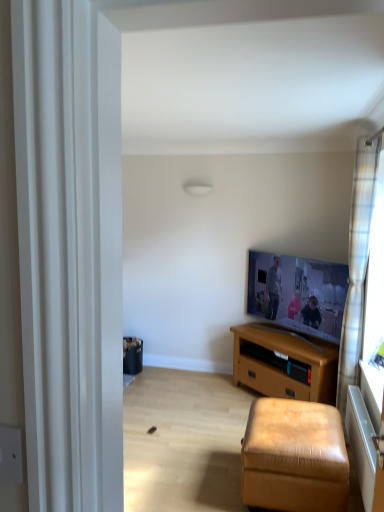
Describe the element at coordinates (284, 362) in the screenshot. The height and width of the screenshot is (512, 384). I see `brown wooden tv stand at center` at that location.

Measure the distance between brown wooden tv stand at center and camera.

They are 3.08 meters apart.

What are the coordinates of `plaid fabric curtain at right` in the screenshot? It's located at (357, 262).

The width and height of the screenshot is (384, 512). What are the coordinates of `leather-like stool at lower right` in the screenshot? It's located at (294, 457).

From a real-world perspective, who is located higher, brown wooden tv stand at center or plaid fabric curtain at right?

plaid fabric curtain at right, from a real-world perspective.

Is brown wooden tv stand at center shorter than plaid fabric curtain at right?

Indeed, brown wooden tv stand at center has a lesser height compared to plaid fabric curtain at right.

Between brown wooden tv stand at center and plaid fabric curtain at right, which one has smaller width?

plaid fabric curtain at right.

How many degrees apart are the facing directions of flat screen tv at upper right and brown wooden tv stand at center?

There is a 0.356-degree angle between the facing directions of flat screen tv at upper right and brown wooden tv stand at center.

Is flat screen tv at upper right bigger or smaller than brown wooden tv stand at center?

Clearly, flat screen tv at upper right is smaller in size than brown wooden tv stand at center.

From the image's perspective, does flat screen tv at upper right appear higher than brown wooden tv stand at center?

Indeed, from the image's perspective, flat screen tv at upper right is shown above brown wooden tv stand at center.

Is flat screen tv at upper right aimed at brown wooden tv stand at center?

No, flat screen tv at upper right is not facing towards brown wooden tv stand at center.

Which is behind, point (326, 414) or point (332, 265)?

The point (332, 265) is behind.

Is leather-like stool at lower right not near flat screen tv at upper right?

Yes, leather-like stool at lower right and flat screen tv at upper right are located far from each other.

From the image's perspective, is leather-like stool at lower right beneath flat screen tv at upper right?

Indeed, from the image's perspective, leather-like stool at lower right is shown beneath flat screen tv at upper right.

Which is more to the left, flat screen tv at upper right or leather-like stool at lower right?

leather-like stool at lower right.

From a real-world perspective, is flat screen tv at upper right above or below leather-like stool at lower right?

flat screen tv at upper right is above leather-like stool at lower right.

Would you say flat screen tv at upper right is a long distance from leather-like stool at lower right?

Yes, flat screen tv at upper right and leather-like stool at lower right are quite far apart.

From a real-world perspective, does plaid fabric curtain at right stand above brown wooden tv stand at center?

Correct, in the physical world, plaid fabric curtain at right is higher than brown wooden tv stand at center.

Between plaid fabric curtain at right and brown wooden tv stand at center, which one has smaller size?

plaid fabric curtain at right is smaller.

Identify the location of curtain above the brown wooden tv stand at center (from a real-world perspective). Image resolution: width=384 pixels, height=512 pixels. (357, 262).

Would you say plaid fabric curtain at right contains brown wooden tv stand at center?

No, brown wooden tv stand at center is located outside of plaid fabric curtain at right.

Who is shorter, brown wooden tv stand at center or leather-like stool at lower right?

With less height is leather-like stool at lower right.

Considering the positions of objects brown wooden tv stand at center and leather-like stool at lower right in the image provided, who is in front, brown wooden tv stand at center or leather-like stool at lower right?

leather-like stool at lower right is in front.

Is brown wooden tv stand at center facing towards leather-like stool at lower right?

Yes, brown wooden tv stand at center faces towards leather-like stool at lower right.

Does point (331, 345) appear closer or farther from the camera than point (320, 419)?

Clearly, point (331, 345) is more distant from the camera than point (320, 419).

Does plaid fabric curtain at right lie behind leather-like stool at lower right?

Yes, it is behind leather-like stool at lower right.

Can we say plaid fabric curtain at right lies outside leather-like stool at lower right?

Indeed, plaid fabric curtain at right is completely outside leather-like stool at lower right.

Looking at this image, from the image's perspective, between plaid fabric curtain at right and leather-like stool at lower right, which one is located above?

plaid fabric curtain at right, from the image's perspective.

Considering the relative sizes of plaid fabric curtain at right and leather-like stool at lower right in the image provided, is plaid fabric curtain at right wider than leather-like stool at lower right?

Incorrect, the width of plaid fabric curtain at right does not surpass that of leather-like stool at lower right.

I want to click on desk lying behind the plaid fabric curtain at right, so click(284, 362).

Where is `desk to the left of flat screen tv at upper right`? desk to the left of flat screen tv at upper right is located at coordinates (284, 362).

Considering their positions, is plaid fabric curtain at right positioned closer to flat screen tv at upper right than brown wooden tv stand at center?

Based on the image, brown wooden tv stand at center appears to be nearer to flat screen tv at upper right.

Based on their spatial positions, is plaid fabric curtain at right or brown wooden tv stand at center further from leather-like stool at lower right?

brown wooden tv stand at center.

Looking at the image, which one is located closer to plaid fabric curtain at right, leather-like stool at lower right or brown wooden tv stand at center?

brown wooden tv stand at center is closer to plaid fabric curtain at right.

Which object lies nearer to the anchor point leather-like stool at lower right, plaid fabric curtain at right or flat screen tv at upper right?

plaid fabric curtain at right lies closer to leather-like stool at lower right than the other object.

From the image, which object appears to be farther from flat screen tv at upper right, brown wooden tv stand at center or plaid fabric curtain at right?

plaid fabric curtain at right is further to flat screen tv at upper right.

Looking at the image, which one is located further to leather-like stool at lower right, brown wooden tv stand at center or plaid fabric curtain at right?

Based on the image, brown wooden tv stand at center appears to be further to leather-like stool at lower right.

Consider the image. Considering their positions, is flat screen tv at upper right positioned closer to brown wooden tv stand at center than leather-like stool at lower right?

flat screen tv at upper right is closer to brown wooden tv stand at center.

From the image, which object appears to be nearer to flat screen tv at upper right, brown wooden tv stand at center or leather-like stool at lower right?

Based on the image, brown wooden tv stand at center appears to be nearer to flat screen tv at upper right.

In order to click on picture frame between plaid fabric curtain at right and brown wooden tv stand at center in the vertical direction in this screenshot , I will do `click(298, 293)`.

Image resolution: width=384 pixels, height=512 pixels. In order to click on picture frame between leather-like stool at lower right and brown wooden tv stand at center from front to back in this screenshot , I will do `click(298, 293)`.

Locate an element on the screen. The width and height of the screenshot is (384, 512). curtain between leather-like stool at lower right and brown wooden tv stand at center along the z-axis is located at coordinates (357, 262).

Where is `picture frame between plaid fabric curtain at right and leather-like stool at lower right vertically`? picture frame between plaid fabric curtain at right and leather-like stool at lower right vertically is located at coordinates (298, 293).